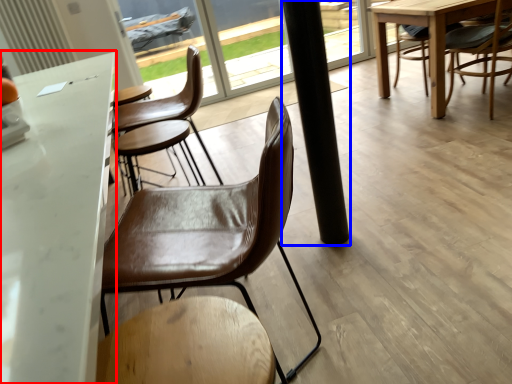
Question: Which object is further to the camera taking this photo, table (highlighted by a red box) or pillar (highlighted by a blue box)?

Choices:
 (A) table
 (B) pillar

Answer: (B)